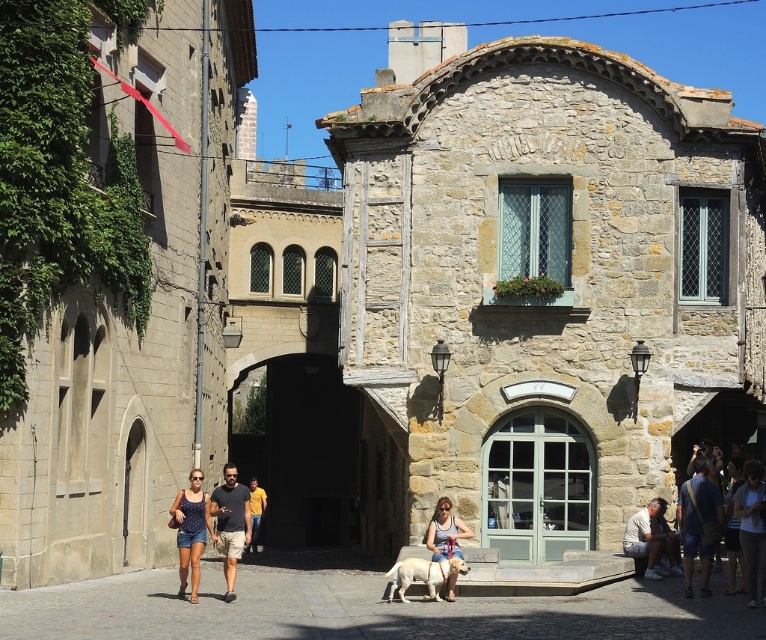
Based on the photo, which is more to the right, matte gray shirt at lower right or matte blue shirt at center?

From the viewer's perspective, matte gray shirt at lower right appears more on the right side.

Describe the element at coordinates (647, 538) in the screenshot. The width and height of the screenshot is (766, 640). I see `matte gray shirt at lower right` at that location.

The image size is (766, 640). In order to click on matte gray shirt at lower right in this screenshot , I will do `click(647, 538)`.

In the scene shown: Does white fur dog at center appear on the left side of yellow cotton shirt at center?

In fact, white fur dog at center is to the right of yellow cotton shirt at center.

Between point (421, 570) and point (250, 499), which one is positioned in front?

Point (421, 570) is more forward.

Where is `white fur dog at center`? The height and width of the screenshot is (640, 766). white fur dog at center is located at coordinates (424, 573).

Can you confirm if white stone dog at center is thinner than blue denim shorts at lower left?

No.

Between white stone dog at center and blue denim shorts at lower left, which one appears on the right side from the viewer's perspective?

From the viewer's perspective, white stone dog at center appears more on the right side.

Who is more distant from viewer, [118,616] or [197,561]?

The point [197,561] is more distant.

At what (x,y) coordinates should I click in order to perform the action: click on white stone dog at center. Please return your answer as a coordinate pair (x, y). This screenshot has height=640, width=766. Looking at the image, I should click on (365, 609).